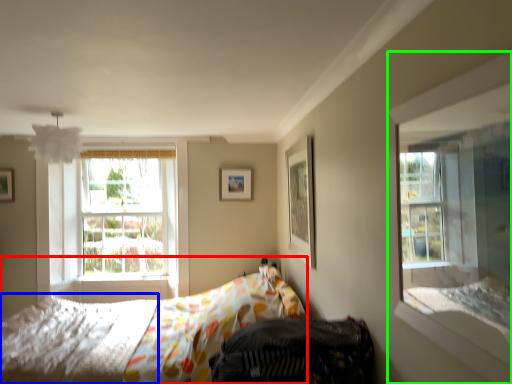
Question: Which is nearer to the bed (highlighted by a red box)? mattress (highlighted by a blue box) or window (highlighted by a green box).

Choices:
 (A) mattress
 (B) window

Answer: (A)